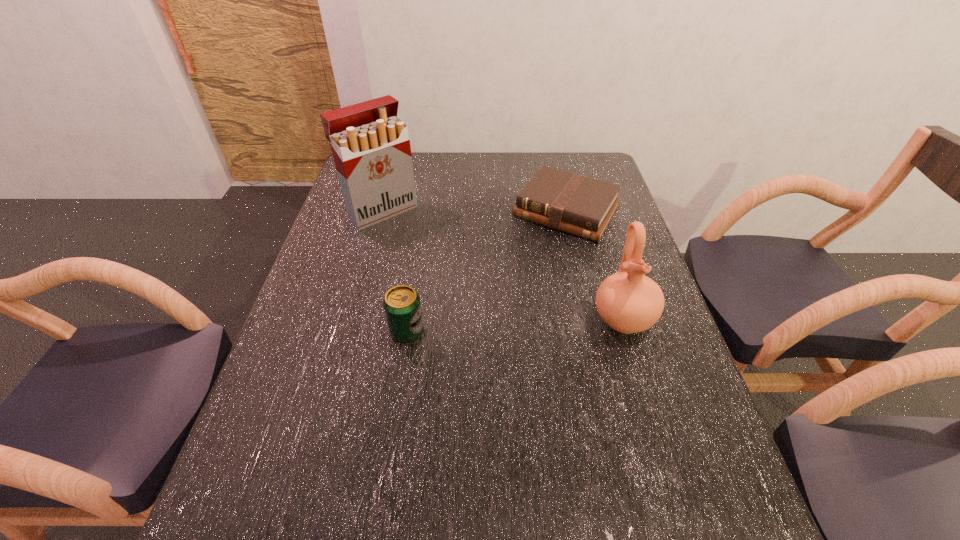
Where is `unoccupied area between the shortest object and the beer can`? The height and width of the screenshot is (540, 960). unoccupied area between the shortest object and the beer can is located at coordinates (487, 272).

Locate which object ranks third in proximity to the Bible. Please provide its 2D coordinates. Your answer should be formatted as a tuple, i.e. [(x, y)], where the tuple contains the x and y coordinates of a point satisfying the conditions above.

[(401, 303)]

Choose which object is the third nearest neighbor to the shortest object. Please provide its 2D coordinates. Your answer should be formatted as a tuple, i.e. [(x, y)], where the tuple contains the x and y coordinates of a point satisfying the conditions above.

[(401, 303)]